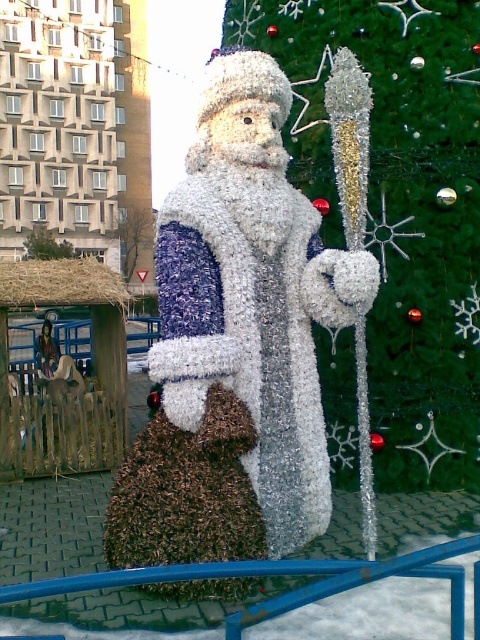
You are a toy store manager arranging a winter display. You have a shiny metallic santa claus at center and a blue metallic rail at center. Which object should you place on the higher shelf to make it more visible to customers?

You should place the shiny metallic santa claus at center on the higher shelf because it is bigger than the blue metallic rail at center, making it more noticeable when elevated.

You are standing at the entrance of the winter scene and want to find the green shiny christmas tree at center. Based on the coordinates provided, in which direction should you look to locate it?

The green shiny christmas tree at center is located at point coordinates, so you should look towards the lower right direction to find it.